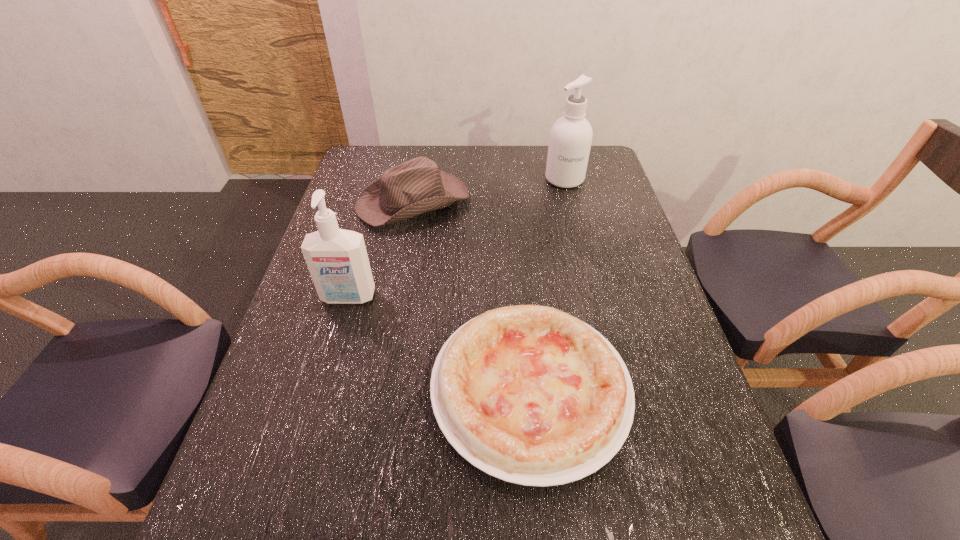
At what (x,y) coordinates should I click in order to perform the action: click on cleansing agent that is at the far edge. Please return your answer as a coordinate pair (x, y). The height and width of the screenshot is (540, 960). Looking at the image, I should click on (571, 135).

Where is `fedora that is at the far edge`? fedora that is at the far edge is located at coordinates (416, 186).

Locate an element on the screen. The width and height of the screenshot is (960, 540). cleansing agent that is at the left edge is located at coordinates (337, 259).

In order to click on fedora that is at the left edge in this screenshot , I will do `click(416, 186)`.

Find the location of `cleansing agent at the right edge`. cleansing agent at the right edge is located at coordinates (571, 135).

Find the location of a particular element. This screenshot has width=960, height=540. pizza that is at the right edge is located at coordinates (529, 394).

This screenshot has width=960, height=540. Find the location of `object present at the far left corner`. object present at the far left corner is located at coordinates (416, 186).

Identify the location of object that is at the far right corner. The image size is (960, 540). (571, 135).

Locate an element on the screen. This screenshot has height=540, width=960. vacant space at the far edge of the desktop is located at coordinates (411, 147).

Find the location of `free space at the left edge`. free space at the left edge is located at coordinates (345, 194).